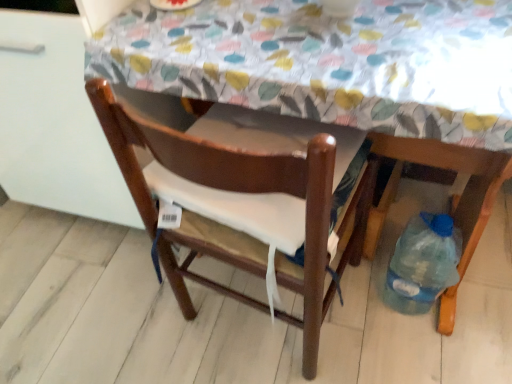
Locate an element on the screen. The image size is (512, 384). vacant space that is in between wooden table at center and translucent plastic bottle at lower right, which appears as the 2th chair when viewed from the left is located at coordinates (369, 332).